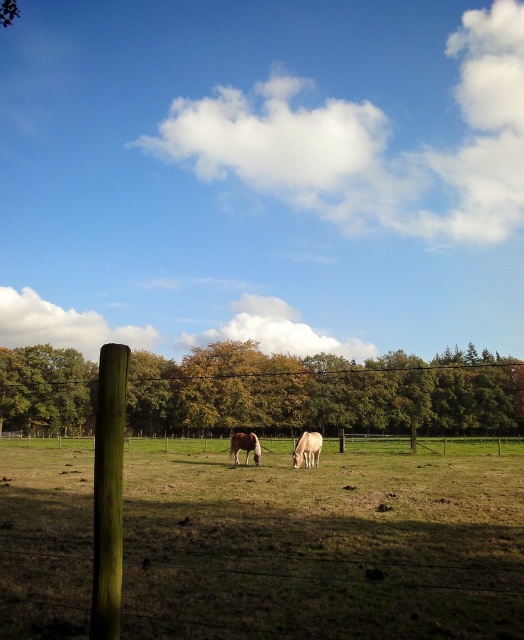
Question: Among these points, which one is farthest from the camera?

Choices:
 (A) (26, 381)
 (B) (302, 444)

Answer: (A)

Question: Where is white glossy horse at center located in relation to brown glossy horse at center in the image?

Choices:
 (A) left
 (B) right

Answer: (B)

Question: Is green wood post at left behind brown glossy horse at center?

Choices:
 (A) no
 (B) yes

Answer: (A)

Question: Where is green leafy tree at left located in relation to white glossy horse at center in the image?

Choices:
 (A) right
 (B) left

Answer: (B)

Question: Which point appears farthest from the camera in this image?

Choices:
 (A) (310, 456)
 (B) (254, 435)
 (C) (81, 424)
 (D) (96, 566)

Answer: (C)

Question: Considering the real-world distances, which object is closest to the white glossy horse at center?

Choices:
 (A) green wood post at left
 (B) brown glossy horse at center

Answer: (B)